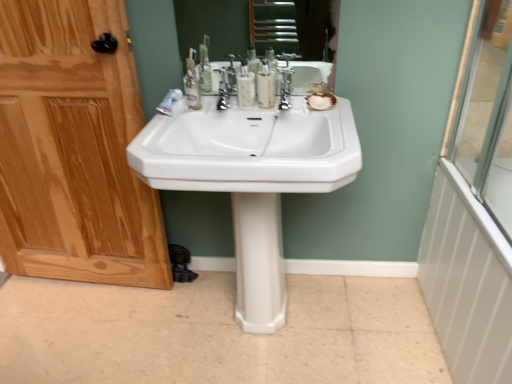
At what (x,y) coordinates should I click in order to perform the action: click on vacant area situated to the left side of white glossy pedestal at center. Please return your answer as a coordinate pair (x, y). Looking at the image, I should click on (211, 312).